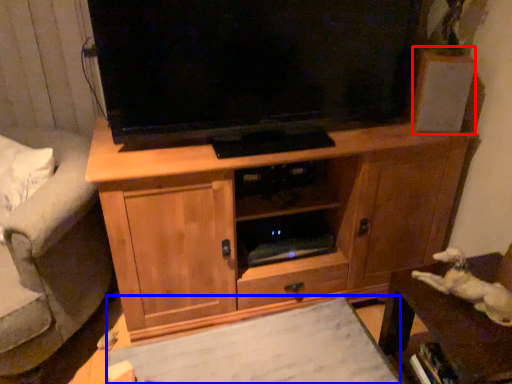
Question: Which of the following is the farthest to the observer, speaker (highlighted by a red box) or plain (highlighted by a blue box)?

Choices:
 (A) speaker
 (B) plain

Answer: (A)